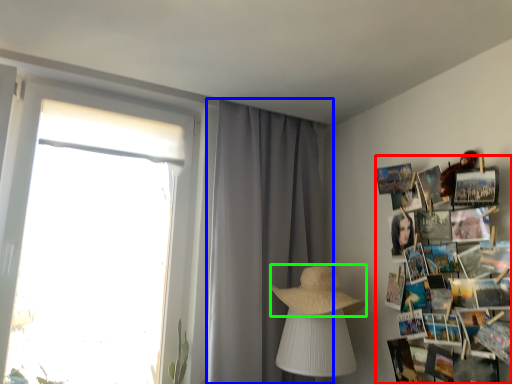
Question: Which object is positioned farthest from magazine (highlighted by a red box)? Select from curtain (highlighted by a blue box) and straw hat (highlighted by a green box).

Choices:
 (A) curtain
 (B) straw hat

Answer: (A)